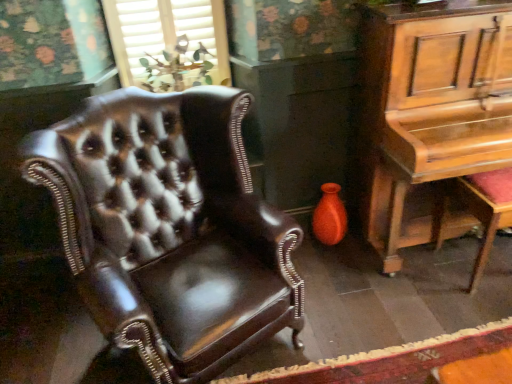
Locate an element on the screen. free location in front of matte orange vase at lower right is located at coordinates (337, 267).